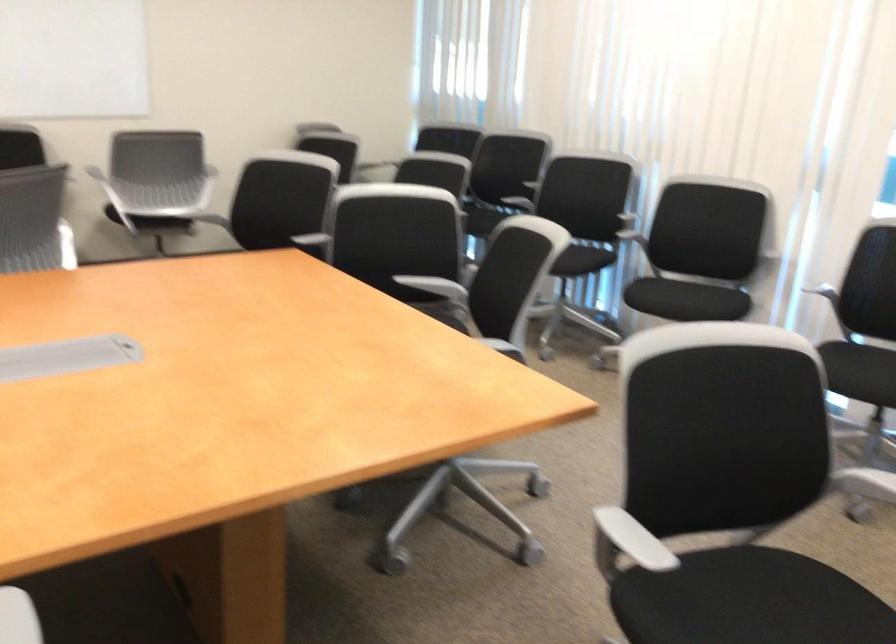
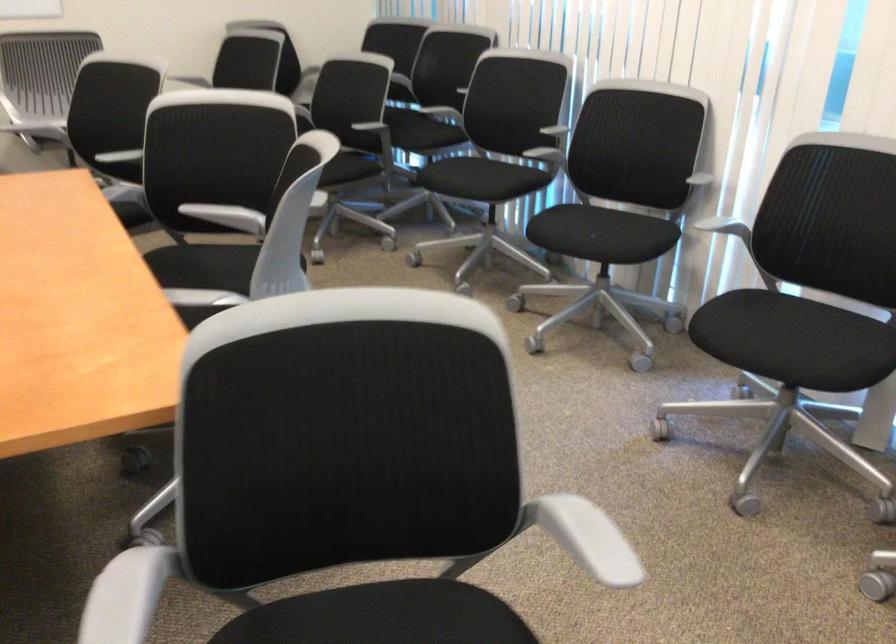
The point at (x=763, y=242) is marked in the first image. Where is the corresponding point in the second image?

(693, 174)